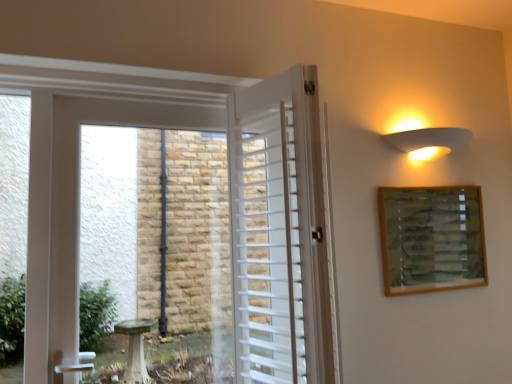
Question: Is white wooden door at center aimed at white matte wall sconce at upper right?

Choices:
 (A) no
 (B) yes

Answer: (A)

Question: Is white wooden door at center not inside white matte wall sconce at upper right?

Choices:
 (A) no
 (B) yes

Answer: (B)

Question: Is white wooden door at center surrounding white matte wall sconce at upper right?

Choices:
 (A) yes
 (B) no

Answer: (B)

Question: From the image's perspective, is white wooden door at center located above white matte wall sconce at upper right?

Choices:
 (A) no
 (B) yes

Answer: (A)

Question: Does white wooden door at center have a lesser height compared to white matte wall sconce at upper right?

Choices:
 (A) yes
 (B) no

Answer: (B)

Question: From the image's perspective, is white wooden door at center positioned above or below wooden picture frame at upper right?

Choices:
 (A) below
 (B) above

Answer: (B)

Question: Considering the positions of white wooden door at center and wooden picture frame at upper right in the image, is white wooden door at center wider or thinner than wooden picture frame at upper right?

Choices:
 (A) wide
 (B) thin

Answer: (A)

Question: Considering the positions of point click(265, 200) and point click(460, 243), is point click(265, 200) closer or farther from the camera than point click(460, 243)?

Choices:
 (A) farther
 (B) closer

Answer: (B)

Question: Is white wooden door at center bigger or smaller than wooden picture frame at upper right?

Choices:
 (A) big
 (B) small

Answer: (A)

Question: Does point (416, 208) appear closer or farther from the camera than point (237, 115)?

Choices:
 (A) farther
 (B) closer

Answer: (A)

Question: Considering the relative positions of wooden picture frame at upper right and white wooden door at center in the image provided, is wooden picture frame at upper right to the left or to the right of white wooden door at center?

Choices:
 (A) left
 (B) right

Answer: (B)

Question: From a real-world perspective, relative to white wooden door at center, is wooden picture frame at upper right vertically above or below?

Choices:
 (A) above
 (B) below

Answer: (B)

Question: Considering the positions of wooden picture frame at upper right and white wooden door at center in the image, is wooden picture frame at upper right bigger or smaller than white wooden door at center?

Choices:
 (A) small
 (B) big

Answer: (A)

Question: Is point (415, 140) closer or farther from the camera than point (308, 152)?

Choices:
 (A) farther
 (B) closer

Answer: (A)

Question: Is white matte wall sconce at upper right inside the boundaries of white wooden door at center, or outside?

Choices:
 (A) inside
 (B) outside

Answer: (B)